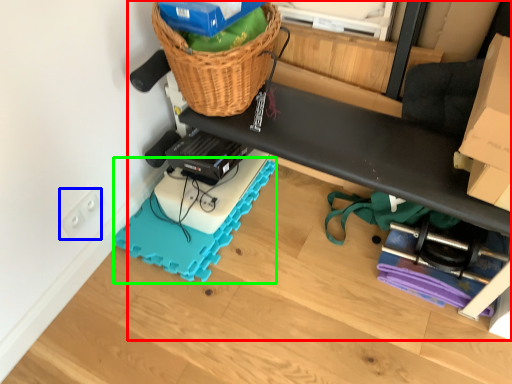
Question: Considering the real-world distances, which object is farthest from furniture (highlighted by a red box)? electric outlet (highlighted by a blue box) or yoga mat (highlighted by a green box)?

Choices:
 (A) electric outlet
 (B) yoga mat

Answer: (A)